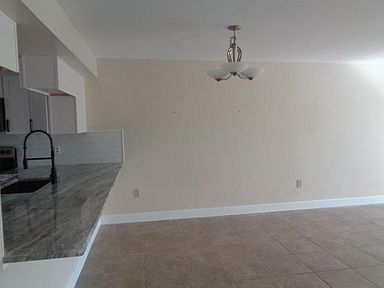
The height and width of the screenshot is (288, 384). I want to click on place where lamp connects to ceiling, so click(238, 25).